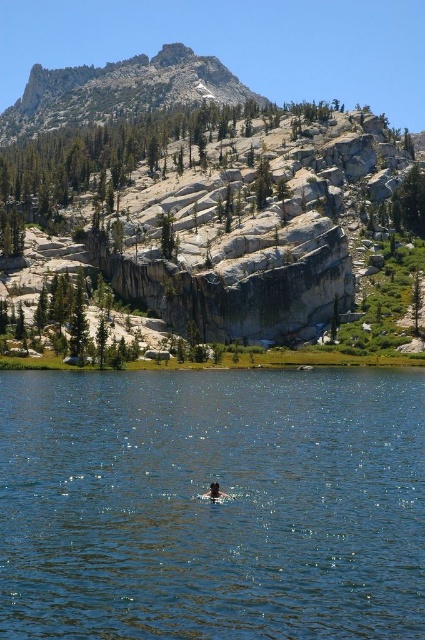
Question: Which object appears closest to the camera in this image?

Choices:
 (A) gray/rocky mountain at upper center
 (B) rugged granite peak at upper center

Answer: (A)

Question: Can you confirm if blue water at center is positioned above rugged granite peak at upper center?

Choices:
 (A) no
 (B) yes

Answer: (A)

Question: Can you confirm if blue water at center is positioned below gray/rocky mountain at upper center?

Choices:
 (A) yes
 (B) no

Answer: (A)

Question: Is blue water at center closer to camera compared to rugged granite peak at upper center?

Choices:
 (A) yes
 (B) no

Answer: (A)

Question: Based on their relative distances, which object is nearer to the gray/rocky mountain at upper center?

Choices:
 (A) rugged granite peak at upper center
 (B) brown hair at center

Answer: (A)

Question: Which object is the closest to the rugged granite peak at upper center?

Choices:
 (A) blue water at center
 (B) gray/rocky mountain at upper center
 (C) brown hair at center

Answer: (B)